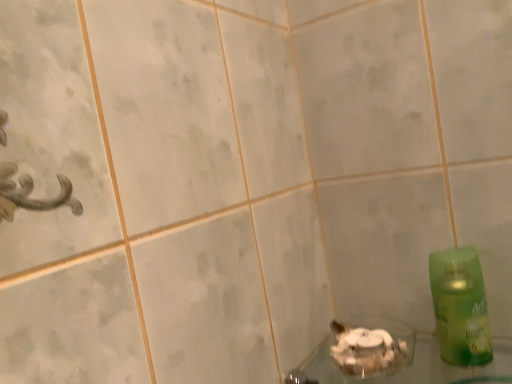
Locate an element on the screen. clear glass bowl at lower center is located at coordinates (401, 361).

In order to face clear glass bowl at lower center, should I rotate leftwards or rightwards?

Rotate your view right by about 24.557°.

The image size is (512, 384). Describe the element at coordinates (401, 361) in the screenshot. I see `clear glass bowl at lower center` at that location.

Where is `green plastic bottle at right`? Image resolution: width=512 pixels, height=384 pixels. green plastic bottle at right is located at coordinates (460, 307).

Describe the element at coordinates (460, 307) in the screenshot. I see `green plastic bottle at right` at that location.

This screenshot has width=512, height=384. In order to click on clear glass bowl at lower center in this screenshot , I will do `click(401, 361)`.

Which object is positioned more to the left, clear glass bowl at lower center or green plastic bottle at right?

From the viewer's perspective, clear glass bowl at lower center appears more on the left side.

Based on the photo, is the depth of clear glass bowl at lower center less than that of green plastic bottle at right?

Yes, clear glass bowl at lower center is in front of green plastic bottle at right.

Is point (369, 359) closer to viewer compared to point (482, 294)?

No, it is behind (482, 294).

From the image's perspective, is clear glass bowl at lower center positioned above or below green plastic bottle at right?

Clearly, from the image's perspective, clear glass bowl at lower center is below green plastic bottle at right.

From a real-world perspective, which is physically below, clear glass bowl at lower center or green plastic bottle at right?

clear glass bowl at lower center, from a real-world perspective.

Which of these two, clear glass bowl at lower center or green plastic bottle at right, is thinner?

green plastic bottle at right.

Considering the sizes of clear glass bowl at lower center and green plastic bottle at right in the image, is clear glass bowl at lower center taller or shorter than green plastic bottle at right?

clear glass bowl at lower center is shorter than green plastic bottle at right.

Considering the relative sizes of clear glass bowl at lower center and green plastic bottle at right in the image provided, is clear glass bowl at lower center smaller than green plastic bottle at right?

Actually, clear glass bowl at lower center might be larger than green plastic bottle at right.

Would you say green plastic bottle at right is part of clear glass bowl at lower center's contents?

Actually, green plastic bottle at right is outside clear glass bowl at lower center.

Is clear glass bowl at lower center directly adjacent to green plastic bottle at right?

No, clear glass bowl at lower center is not making contact with green plastic bottle at right.

Is clear glass bowl at lower center oriented away from green plastic bottle at right?

That's not correct — clear glass bowl at lower center is not looking away from green plastic bottle at right.

In the scene shown: How many degrees apart are the facing directions of clear glass bowl at lower center and green plastic bottle at right?

The facing directions of clear glass bowl at lower center and green plastic bottle at right are 3.01 degrees apart.

Find the location of a particular element. The width and height of the screenshot is (512, 384). bottle that is above the clear glass bowl at lower center (from a real-world perspective) is located at coordinates (460, 307).

Between green plastic bottle at right and clear glass bowl at lower center, which one appears on the left side from the viewer's perspective?

Positioned to the left is clear glass bowl at lower center.

Considering their positions, is green plastic bottle at right located in front of or behind clear glass bowl at lower center?

In the image, green plastic bottle at right appears behind clear glass bowl at lower center.

Which is closer to the camera, (436, 327) or (453, 379)?

Point (436, 327) appears to be closer to the viewer than point (453, 379).

From the image's perspective, which object appears higher, green plastic bottle at right or clear glass bowl at lower center?

green plastic bottle at right appears higher in the image.

In the scene shown: From a real-world perspective, who is located lower, green plastic bottle at right or clear glass bowl at lower center?

clear glass bowl at lower center, from a real-world perspective.

Looking at this image, can you confirm if green plastic bottle at right is wider than clear glass bowl at lower center?

Incorrect, the width of green plastic bottle at right does not surpass that of clear glass bowl at lower center.

Which of these two, green plastic bottle at right or clear glass bowl at lower center, stands shorter?

clear glass bowl at lower center is shorter.

Who is smaller, green plastic bottle at right or clear glass bowl at lower center?

green plastic bottle at right.

Is clear glass bowl at lower center surrounded by green plastic bottle at right?

No.

In the scene shown: Can you see green plastic bottle at right touching clear glass bowl at lower center?

green plastic bottle at right and clear glass bowl at lower center are clearly separated.

Is green plastic bottle at right oriented away from clear glass bowl at lower center?

No.

How different are the orientations of green plastic bottle at right and clear glass bowl at lower center in degrees?

They differ by 3.01 degrees in their facing directions.

How far apart are green plastic bottle at right and clear glass bowl at lower center?

green plastic bottle at right is 4.28 inches away from clear glass bowl at lower center.

Image resolution: width=512 pixels, height=384 pixels. Find the location of `bottle located above the clear glass bowl at lower center (from the image's perspective)`. bottle located above the clear glass bowl at lower center (from the image's perspective) is located at coordinates (460, 307).

Image resolution: width=512 pixels, height=384 pixels. In order to click on bottle above the clear glass bowl at lower center (from the image's perspective) in this screenshot , I will do `click(460, 307)`.

Where is `bottle on the right of clear glass bowl at lower center`? This screenshot has width=512, height=384. bottle on the right of clear glass bowl at lower center is located at coordinates (460, 307).